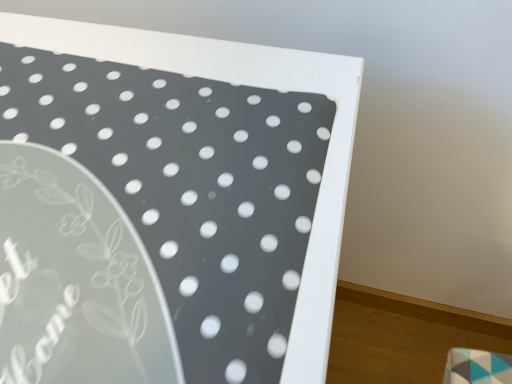
Describe the element at coordinates (168, 205) in the screenshot. This screenshot has width=512, height=384. I see `white glossy board at upper left` at that location.

Identify the location of white glossy board at upper left. The width and height of the screenshot is (512, 384). (168, 205).

What are the coordinates of `white glossy board at upper left` in the screenshot? It's located at (168, 205).